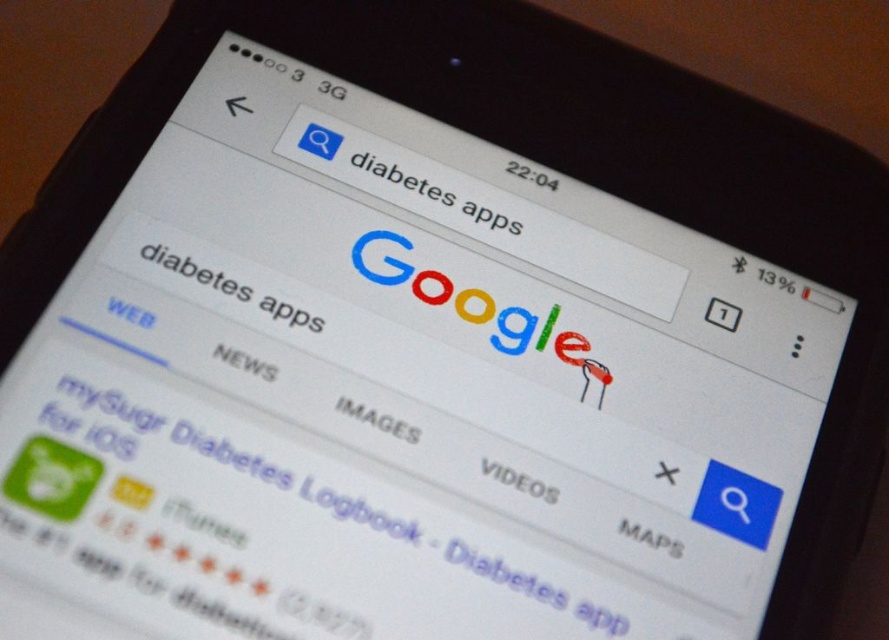
Question: Does green glossy app icon at lower left have a greater width compared to white text at center?

Choices:
 (A) yes
 (B) no

Answer: (A)

Question: Can you confirm if green glossy app icon at lower left is positioned below white text at center?

Choices:
 (A) no
 (B) yes

Answer: (B)

Question: Which point is closer to the camera?

Choices:
 (A) green glossy app icon at lower left
 (B) white text at center

Answer: (A)

Question: Which point is closer to the camera?

Choices:
 (A) (430, 193)
 (B) (343, 596)

Answer: (B)

Question: Does green glossy app icon at lower left come in front of white text at center?

Choices:
 (A) no
 (B) yes

Answer: (B)